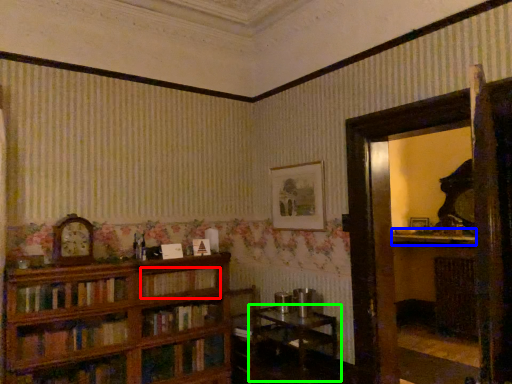
Question: Which is nearer to the book (highlighted by a red box)? mantle (highlighted by a blue box) or table (highlighted by a green box).

Choices:
 (A) mantle
 (B) table

Answer: (B)